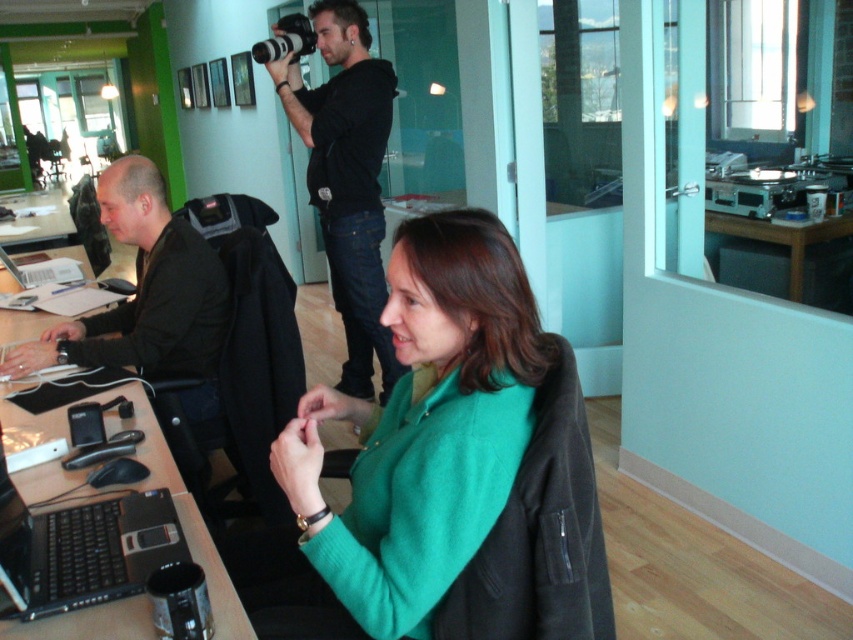
In the scene shown: Does black plastic table at lower left have a greater height compared to black plastic laptop at lower left?

Yes.

Does black plastic table at lower left have a lesser height compared to black plastic laptop at lower left?

No, black plastic table at lower left is not shorter than black plastic laptop at lower left.

This screenshot has height=640, width=853. What do you see at coordinates (180, 509) in the screenshot? I see `black plastic table at lower left` at bounding box center [180, 509].

This screenshot has width=853, height=640. I want to click on black plastic table at lower left, so click(x=180, y=509).

Between black cotton hoodie at upper center and black plastic table at lower left, which one is positioned lower?

black plastic table at lower left is below.

Does point (351, 244) lie behind point (138, 600)?

Yes, it is behind point (138, 600).

Where is `black cotton hoodie at upper center`? Image resolution: width=853 pixels, height=640 pixels. black cotton hoodie at upper center is located at coordinates (347, 179).

In the scene shown: Is black matte jacket at left taller than silver metallic laptop at left?

Indeed, black matte jacket at left has a greater height compared to silver metallic laptop at left.

Is point (131, 237) farther from camera compared to point (70, 272)?

No, it is in front of (70, 272).

Locate an element on the screen. black matte jacket at left is located at coordinates (143, 291).